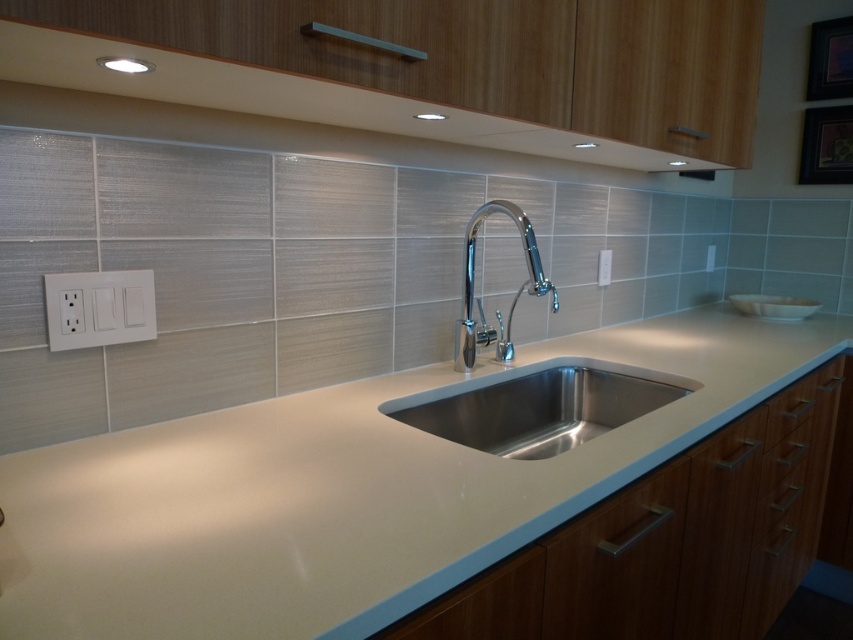
Between white glossy countertop at center and white plastic/light switch at left, which one is positioned higher?

Positioned higher is white plastic/light switch at left.

Which of these two, white glossy countertop at center or white plastic/light switch at left, stands taller?

With more height is white glossy countertop at center.

Is point (253, 422) positioned behind point (97, 326)?

Yes, it is behind point (97, 326).

The height and width of the screenshot is (640, 853). I want to click on white glossy countertop at center, so click(346, 492).

Is wooden drawer at lower right wider than white plastic electric outlet at upper center?

Correct, the width of wooden drawer at lower right exceeds that of white plastic electric outlet at upper center.

Can you confirm if wooden drawer at lower right is taller than white plastic electric outlet at upper center?

Indeed, wooden drawer at lower right has a greater height compared to white plastic electric outlet at upper center.

What are the coordinates of `wooden drawer at lower right` in the screenshot? It's located at (788, 408).

Does white glossy countertop at center have a lesser width compared to stainless steel sink at center?

No, white glossy countertop at center is not thinner than stainless steel sink at center.

Does white glossy countertop at center have a larger size compared to stainless steel sink at center?

Indeed, white glossy countertop at center has a larger size compared to stainless steel sink at center.

Locate an element on the screen. The width and height of the screenshot is (853, 640). white glossy countertop at center is located at coordinates (346, 492).

In order to click on white glossy countertop at center in this screenshot , I will do `click(346, 492)`.